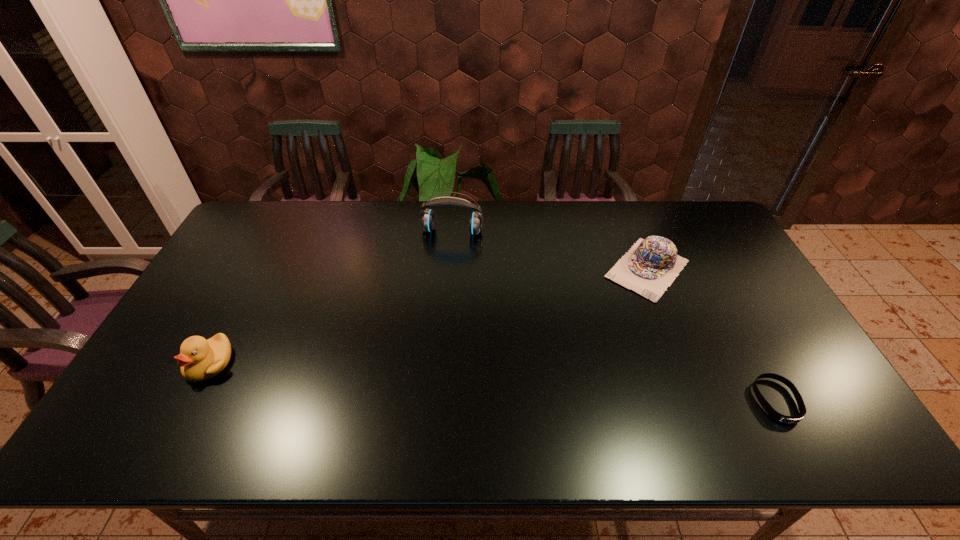
The image size is (960, 540). What are the coordinates of `free space located 0.150m on the front, side, and top of the second shortest object` in the screenshot? It's located at (601, 323).

You are a GUI agent. You are given a task and a screenshot of the screen. Output one action in this format:
    pyautogui.click(x=<x>, y=<y>)
    Task: Click on the vacant space located on the front, side, and top of the second shortest object
    This screenshot has width=960, height=540.
    Given the screenshot: What is the action you would take?
    point(613,309)

At what (x,y) coordinates should I click in order to perform the action: click on free space located 0.350m on the front, side, and top of the second shortest object. Please return your answer as a coordinate pair (x, y). This screenshot has height=540, width=960. Looking at the image, I should click on (563, 369).

I want to click on headset that is at the far edge, so click(427, 219).

I want to click on cap at the far edge, so click(651, 265).

Image resolution: width=960 pixels, height=540 pixels. Find the location of `duckling that is at the near edge`. duckling that is at the near edge is located at coordinates (200, 359).

Find the location of a particular element. wristband located in the near edge section of the desktop is located at coordinates (775, 415).

You are a GUI agent. You are given a task and a screenshot of the screen. Output one action in this format:
    pyautogui.click(x=<x>, y=<y>)
    Task: Click on the object at the left edge
    
    Given the screenshot: What is the action you would take?
    pyautogui.click(x=200, y=359)

Where is `object at the right edge`? The width and height of the screenshot is (960, 540). object at the right edge is located at coordinates (775, 415).

The image size is (960, 540). I want to click on object located at the near left corner, so click(200, 359).